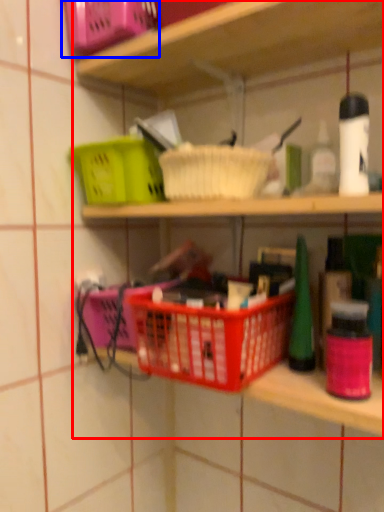
Question: Among these objects, which one is farthest to the camera, shelf (highlighted by a red box) or basket (highlighted by a blue box)?

Choices:
 (A) shelf
 (B) basket

Answer: (B)